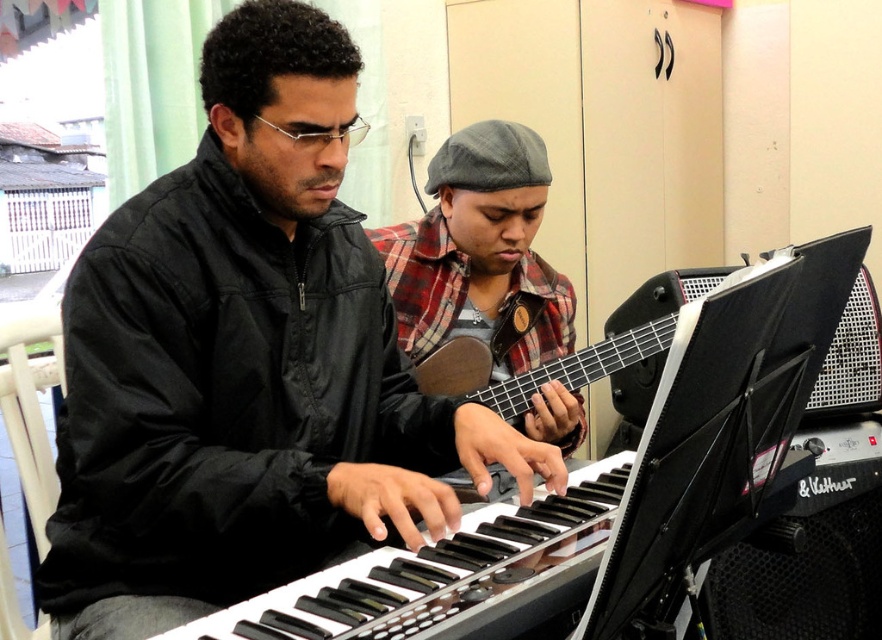
From the picture: You are a photographer setting up for a shoot in this room. You need to position two guitars so they are close enough to be captured in a single frame without moving the camera. Given that your camera has a maximum focus range of 15 centimeters, will the plaid fabric guitar at center and the wooden acoustic guitar at center fit within this range?

The distance between the plaid fabric guitar at center and the wooden acoustic guitar at center is 14.31 centimeters, which is within the camera maximum focus range of 15 centimeters. Therefore, the two guitars can be captured in a single frame without moving the camera.

You are standing in the room and want to place a small plant exactly at the point marked as point [602,504]. Considering your height is 1.7 meters, will the plant be visible to you without bending down?

The distance of point [602,504] from viewer is 1.28 meters. Since the plant is placed at this point, and assuming standard plant height, it would likely be visible as it is within a typical viewing range without needing to bend down.